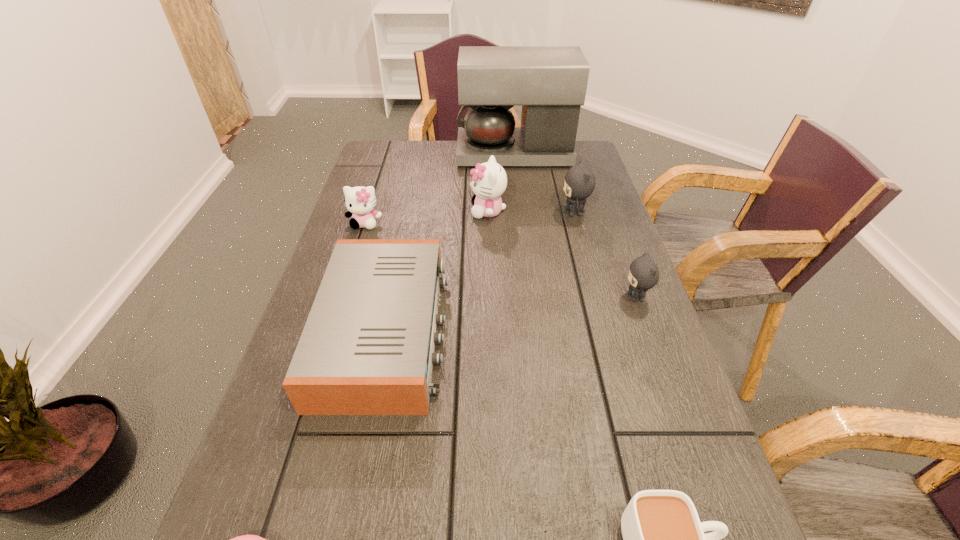
The image size is (960, 540). I want to click on vacant space at the left edge of the desktop, so click(242, 525).

Locate an element on the screen. vacant point at the right edge is located at coordinates (590, 248).

Find the location of a particular element. The width and height of the screenshot is (960, 540). free spot at the far left corner of the desktop is located at coordinates (363, 169).

Where is `blank space at the far right corner of the desktop`? The image size is (960, 540). blank space at the far right corner of the desktop is located at coordinates (589, 151).

This screenshot has height=540, width=960. Find the location of `free space between the bigger white kitten and the bigger gray kitten`. free space between the bigger white kitten and the bigger gray kitten is located at coordinates (531, 212).

At what (x,y) coordinates should I click in order to perform the action: click on free space between the second kitten from right to left and the left white kitten. Please return your answer as a coordinate pair (x, y). The height and width of the screenshot is (540, 960). Looking at the image, I should click on (469, 218).

This screenshot has height=540, width=960. Identify the location of free space between the right gray kitten and the farthest object. (575, 226).

What are the coordinates of `free space between the nearer gray kitten and the second kitten from left to right` in the screenshot? It's located at (562, 254).

This screenshot has width=960, height=540. I want to click on object that is the second nearest to the coffee maker, so click(489, 180).

Locate which object is the fourth closest to the cup. Please provide its 2D coordinates. Your answer should be formatted as a tuple, i.e. [(x, y)], where the tuple contains the x and y coordinates of a point satisfying the conditions above.

[(579, 184)]